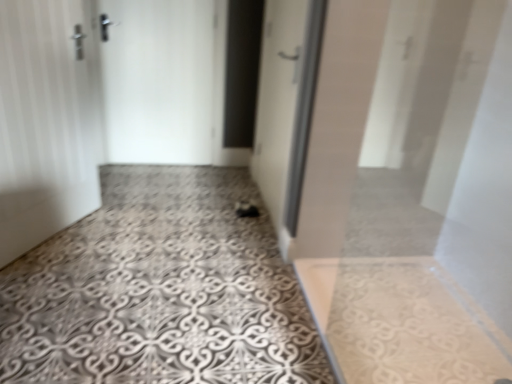
Question: Considering the positions of white matte door at center, the 2th door in the right-to-left sequence, and white glossy door at center, which is the 3th door from left to right, in the image, is white matte door at center, the 2th door in the right-to-left sequence, taller or shorter than white glossy door at center, which is the 3th door from left to right,?

Choices:
 (A) short
 (B) tall

Answer: (A)

Question: Does point click(x=115, y=69) appear closer or farther from the camera than point click(x=273, y=69)?

Choices:
 (A) farther
 (B) closer

Answer: (A)

Question: Estimate the real-world distances between objects in this image. Which object is closer to the white glossy door at center, the first door in the right-to-left sequence?

Choices:
 (A) patterned concrete floor at center
 (B) white matte door at center, the second door in the left-to-right sequence
 (C) white matte door at left, the 3th door when ordered from right to left

Answer: (A)

Question: Based on their relative distances, which object is nearer to the white matte door at center, the second door in the left-to-right sequence?

Choices:
 (A) white matte door at left, the 3th door when ordered from right to left
 (B) patterned concrete floor at center
 (C) white glossy door at center, the first door in the right-to-left sequence

Answer: (C)